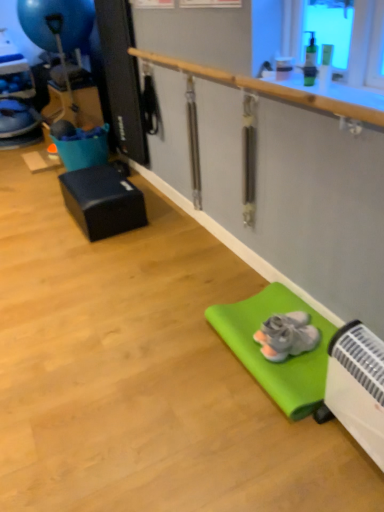
Locate an element on the screen. The width and height of the screenshot is (384, 512). unoccupied space behind gray suede sneakers at lower right is located at coordinates (268, 309).